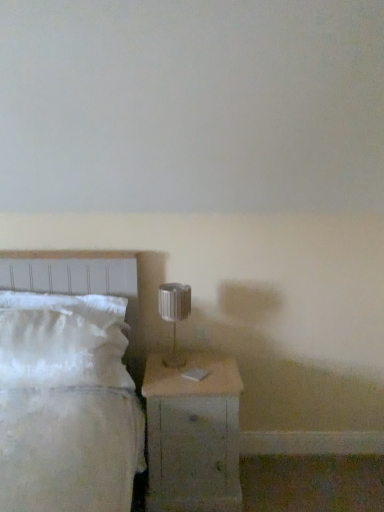
Find the location of a particular element. vacant region in front of metallic silver table lamp at center is located at coordinates (180, 375).